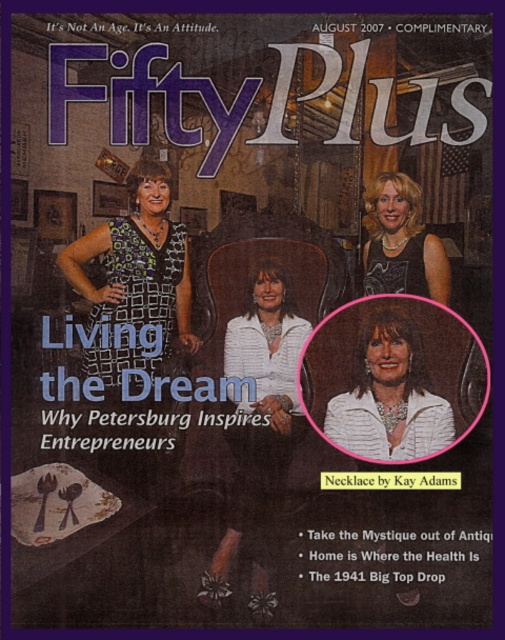
Which of the two items, the printed fabric dress at left or the white matte jacket at center, takes up more space in the magazine cover image?

The white matte jacket at center takes up more space than the printed fabric dress at left.

Based on the photo, you are a fashion designer observing the magazine cover. You need to determine which garment has a wider silhouette between the printed fabric dress at left and the white matte jacket at center. Which one is wider?

The printed fabric dress at left has a larger width than the white matte jacket at center, so the printed fabric dress at left has a wider silhouette.